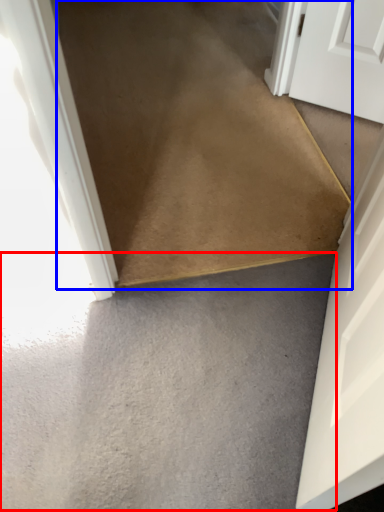
Question: Which point is further to the camera, concrete (highlighted by a red box) or path (highlighted by a blue box)?

Choices:
 (A) concrete
 (B) path

Answer: (B)